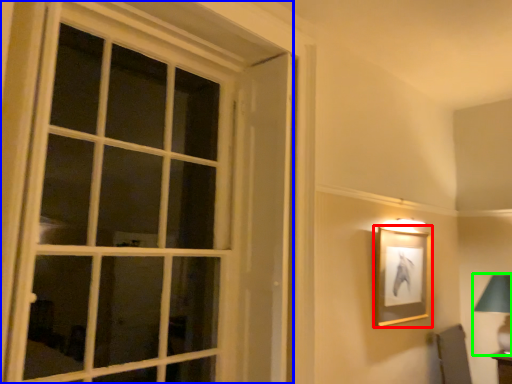
Question: Based on their relative distances, which object is nearer to picture frame (highlighted by a red box)? Choose from window (highlighted by a blue box) and bedside lamp (highlighted by a green box).

Choices:
 (A) window
 (B) bedside lamp

Answer: (B)